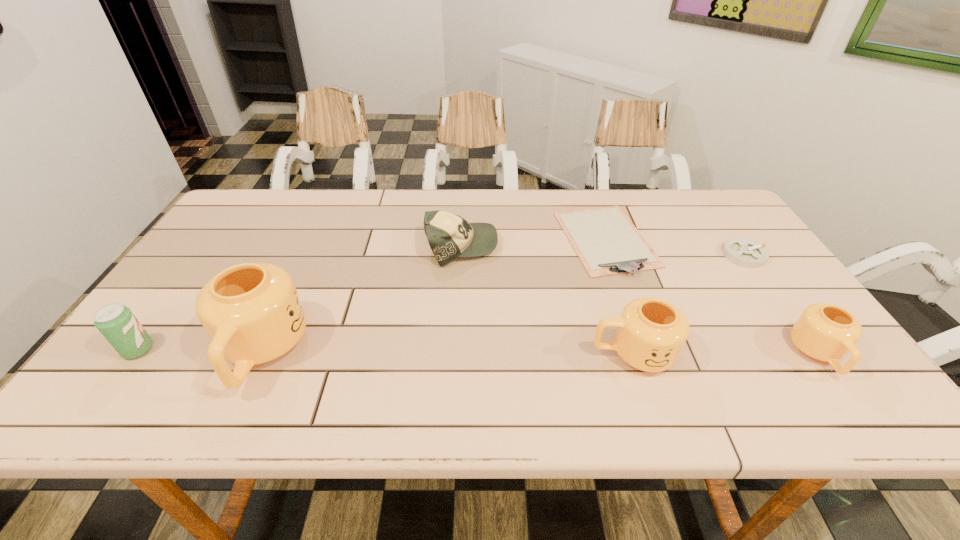
This screenshot has width=960, height=540. I want to click on the tallest object, so click(252, 313).

This screenshot has height=540, width=960. Find the location of `the leftmost mug`. the leftmost mug is located at coordinates (252, 313).

In order to click on the second mug from left to right in this screenshot , I will do `click(651, 333)`.

You are a GUI agent. You are given a task and a screenshot of the screen. Output one action in this format:
    pyautogui.click(x=<x>, y=<y>)
    Task: Click on the shortest mug
    The image size is (960, 540).
    Given the screenshot: What is the action you would take?
    pyautogui.click(x=825, y=332)

This screenshot has height=540, width=960. Identify the location of clipboard. (607, 243).

Locate an element on the screen. The width and height of the screenshot is (960, 540). the fifth tallest object is located at coordinates (450, 236).

I want to click on baseball cap, so click(450, 236).

Where is `ashtray`? ashtray is located at coordinates (744, 252).

Where is `soda`? This screenshot has height=540, width=960. soda is located at coordinates 116,322.

I want to click on vacant space located 0.160m on the handle side of the second shortest mug, so click(x=520, y=354).